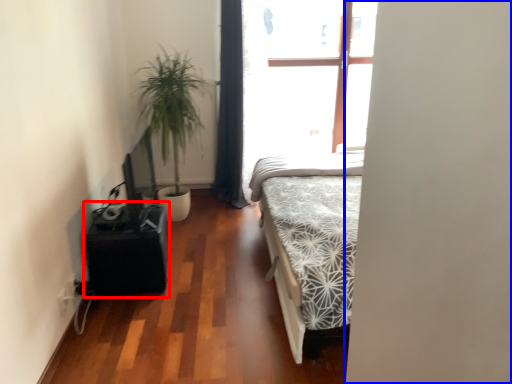
Question: Which object is further to the camera taking this photo, table (highlighted by a red box) or screen door (highlighted by a blue box)?

Choices:
 (A) table
 (B) screen door

Answer: (A)